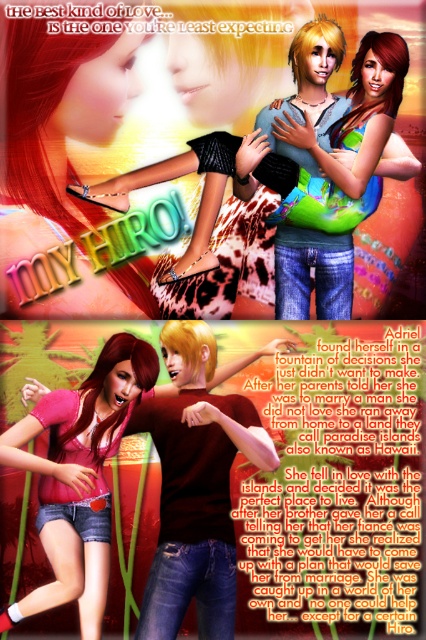
Question: Which point is closer to the camera?

Choices:
 (A) (344, 216)
 (B) (28, 321)
 (C) (57, 480)

Answer: (C)

Question: In this image, where is denim shorts at lower left located relative to shiny green bikini top at center?

Choices:
 (A) below
 (B) above

Answer: (A)

Question: Is denim shorts at lower left below matte pink shirt at center?

Choices:
 (A) no
 (B) yes

Answer: (A)

Question: Where is denim shorts at lower left located in relation to shiny green bikini top at center in the image?

Choices:
 (A) above
 (B) below

Answer: (B)

Question: Which object appears farthest from the camera in this image?

Choices:
 (A) matte pink shirt at center
 (B) denim shorts at lower left
 (C) shiny green bikini top at center

Answer: (C)

Question: Which point appears farthest from the camera in this image?

Choices:
 (A) (48, 492)
 (B) (345, 116)
 (C) (141, 451)

Answer: (C)